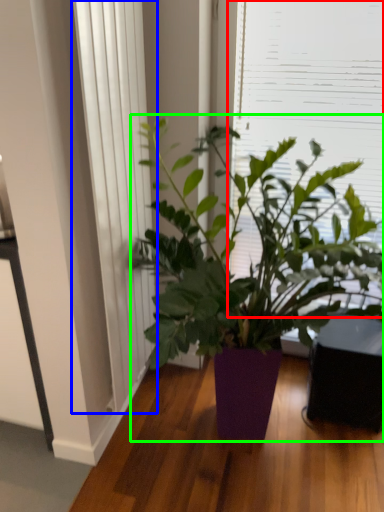
Question: Estimate the real-world distances between objects in this image. Which object is closer to window screen (highlighted by a red box), curtain (highlighted by a blue box) or houseplant (highlighted by a green box)?

Choices:
 (A) curtain
 (B) houseplant

Answer: (B)